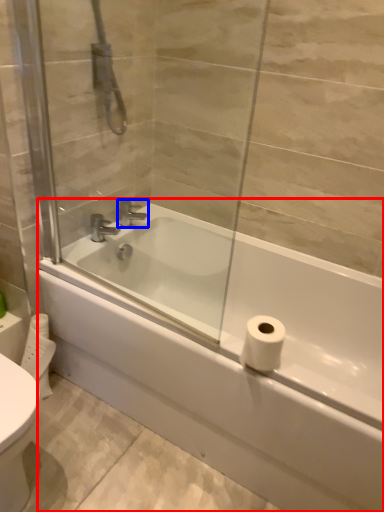
Question: Among these objects, which one is nearest to the camera, bathtub (highlighted by a red box) or tap (highlighted by a blue box)?

Choices:
 (A) bathtub
 (B) tap

Answer: (A)